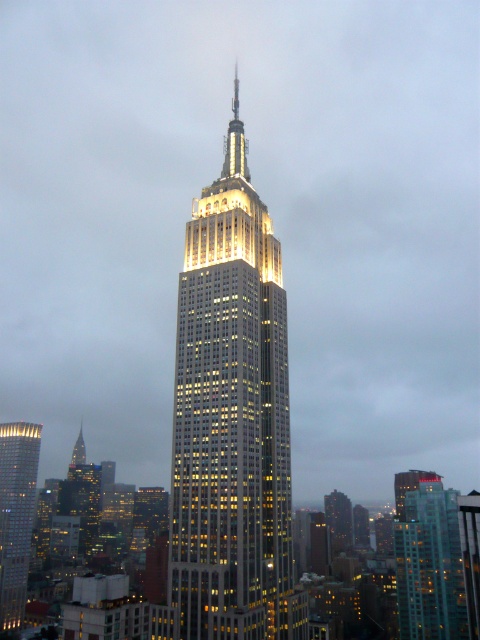
You are a city planner analyzing the skyline of New York City. You observe the illuminated glass skyscraper at center and the teal glass building at center. Which building has a narrower width?

The illuminated glass skyscraper at center is thinner than the teal glass building at center, so it has a narrower width.